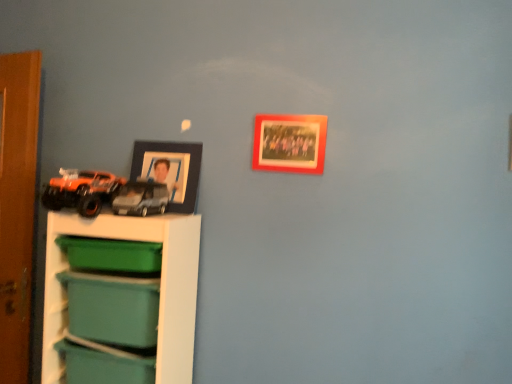
This screenshot has height=384, width=512. What do you see at coordinates (104, 363) in the screenshot?
I see `teal plastic storage box at lower left, which is counted as the third storage box, starting from the top` at bounding box center [104, 363].

How much space does green plastic storage box at lower left, the first storage box when ordered from top to bottom, occupy vertically?

green plastic storage box at lower left, the first storage box when ordered from top to bottom, is 11.07 centimeters in height.

Describe the element at coordinates (111, 254) in the screenshot. This screenshot has width=512, height=384. I see `green plastic storage box at lower left, the 3th storage box ordered from the bottom` at that location.

The image size is (512, 384). What do you see at coordinates (141, 199) in the screenshot?
I see `matte black car at left, arranged as the 1th toy when viewed from the right` at bounding box center [141, 199].

At what (x,y) coordinates should I click in order to perform the action: click on wooden photo frame at upper center, acting as the first picture frame starting from the right. Please return your answer as a coordinate pair (x, y). This screenshot has width=512, height=384. Looking at the image, I should click on (289, 143).

Does wooden photo frame at upper center, which is the 2th picture frame in left-to-right order, have a smaller size compared to green plastic storage box at lower left, the first storage box when ordered from top to bottom?

Yes, wooden photo frame at upper center, which is the 2th picture frame in left-to-right order, is smaller than green plastic storage box at lower left, the first storage box when ordered from top to bottom.

Is wooden photo frame at upper center, which is the 2th picture frame in left-to-right order, at the right side of green plastic storage box at lower left, the first storage box when ordered from top to bottom?

Indeed, wooden photo frame at upper center, which is the 2th picture frame in left-to-right order, is positioned on the right side of green plastic storage box at lower left, the first storage box when ordered from top to bottom.

Is wooden photo frame at upper center, acting as the first picture frame starting from the right, thinner than green plastic storage box at lower left, the first storage box when ordered from top to bottom?

Indeed, wooden photo frame at upper center, acting as the first picture frame starting from the right, has a lesser width compared to green plastic storage box at lower left, the first storage box when ordered from top to bottom.

From the image's perspective, would you say wooden photo frame at upper center, acting as the first picture frame starting from the right, is shown under green plastic storage box at lower left, the 3th storage box ordered from the bottom?

Actually, wooden photo frame at upper center, acting as the first picture frame starting from the right, appears above green plastic storage box at lower left, the 3th storage box ordered from the bottom, in the image.

Which of these two, matte green plastic storage box at lower left, the 2th storage box positioned from the top, or green plastic storage box at lower left, the 3th storage box ordered from the bottom, stands taller?

Standing taller between the two is matte green plastic storage box at lower left, the 2th storage box positioned from the top.

Is matte green plastic storage box at lower left, the 2th storage box when ordered from bottom to top, situated inside green plastic storage box at lower left, the 3th storage box ordered from the bottom, or outside?

matte green plastic storage box at lower left, the 2th storage box when ordered from bottom to top, is spatially situated outside green plastic storage box at lower left, the 3th storage box ordered from the bottom.

How much distance is there between matte green plastic storage box at lower left, the 2th storage box positioned from the top, and green plastic storage box at lower left, the 3th storage box ordered from the bottom?

matte green plastic storage box at lower left, the 2th storage box positioned from the top, is 4.68 inches from green plastic storage box at lower left, the 3th storage box ordered from the bottom.

Are matte green plastic storage box at lower left, the 2th storage box positioned from the top, and green plastic storage box at lower left, the first storage box when ordered from top to bottom, far apart?

No, matte green plastic storage box at lower left, the 2th storage box positioned from the top, is not far from green plastic storage box at lower left, the first storage box when ordered from top to bottom.

Is matte black car at left, which is the second toy in left-to-right order, positioned behind matte green plastic storage box at lower left, the 2th storage box when ordered from bottom to top?

Yes, matte black car at left, which is the second toy in left-to-right order, is further from the viewer.

Considering the points (121, 197) and (155, 316), which point is behind, point (121, 197) or point (155, 316)?

Point (121, 197)

Looking at this image, could you tell me if matte black car at left, arranged as the 1th toy when viewed from the right, is turned towards matte green plastic storage box at lower left, the 2th storage box positioned from the top?

No, matte black car at left, arranged as the 1th toy when viewed from the right, is not oriented towards matte green plastic storage box at lower left, the 2th storage box positioned from the top.

Which object is closer to the camera, green plastic storage box at lower left, the first storage box when ordered from top to bottom, or white plastic shelf at lower left?

white plastic shelf at lower left is closer to the camera.

From the image's perspective, is green plastic storage box at lower left, the first storage box when ordered from top to bottom, above white plastic shelf at lower left?

Yes, from the image's perspective, green plastic storage box at lower left, the first storage box when ordered from top to bottom, is over white plastic shelf at lower left.

From a real-world perspective, relative to white plastic shelf at lower left, is green plastic storage box at lower left, the 3th storage box ordered from the bottom, vertically above or below?

From a real-world perspective, green plastic storage box at lower left, the 3th storage box ordered from the bottom, is physically above white plastic shelf at lower left.

Is matte green plastic storage box at lower left, the 2th storage box when ordered from bottom to top, inside or outside of teal plastic storage box at lower left, which is counted as the third storage box, starting from the top?

matte green plastic storage box at lower left, the 2th storage box when ordered from bottom to top, exists outside the volume of teal plastic storage box at lower left, which is counted as the third storage box, starting from the top.

From the image's perspective, is matte green plastic storage box at lower left, the 2th storage box positioned from the top, above teal plastic storage box at lower left, the 1th storage box ordered from the bottom?

Yes, from the image's perspective, matte green plastic storage box at lower left, the 2th storage box positioned from the top, is over teal plastic storage box at lower left, the 1th storage box ordered from the bottom.

Is matte green plastic storage box at lower left, the 2th storage box positioned from the top, directly adjacent to teal plastic storage box at lower left, the 1th storage box ordered from the bottom?

matte green plastic storage box at lower left, the 2th storage box positioned from the top, and teal plastic storage box at lower left, the 1th storage box ordered from the bottom, are not in contact.

Is teal plastic storage box at lower left, which is counted as the third storage box, starting from the top, at the back of matte green plastic storage box at lower left, the 2th storage box when ordered from bottom to top?

That's not correct — matte green plastic storage box at lower left, the 2th storage box when ordered from bottom to top, is not looking away from teal plastic storage box at lower left, which is counted as the third storage box, starting from the top.

From a real-world perspective, does white plastic shelf at lower left stand above matte green plastic storage box at lower left, the 2th storage box when ordered from bottom to top?

Incorrect, from a real-world perspective, white plastic shelf at lower left is lower than matte green plastic storage box at lower left, the 2th storage box when ordered from bottom to top.

Is white plastic shelf at lower left aimed at matte green plastic storage box at lower left, the 2th storage box when ordered from bottom to top?

Yes, white plastic shelf at lower left is aimed at matte green plastic storage box at lower left, the 2th storage box when ordered from bottom to top.

In the image, is white plastic shelf at lower left on the left side or the right side of matte green plastic storage box at lower left, the 2th storage box positioned from the top?

white plastic shelf at lower left is to the left of matte green plastic storage box at lower left, the 2th storage box positioned from the top.

The width and height of the screenshot is (512, 384). I want to click on storage box that is the 1st object located behind the white plastic shelf at lower left, so click(112, 308).

Based on the photo, can you confirm if white plastic shelf at lower left is bigger than orange matte truck at left, which is counted as the first toy, starting from the left?

Correct, white plastic shelf at lower left is larger in size than orange matte truck at left, which is counted as the first toy, starting from the left.

You are a GUI agent. You are given a task and a screenshot of the screen. Output one action in this format:
    pyautogui.click(x=<x>, y=<y>)
    Task: Click on the shelf below the orange matte truck at left, arranged as the 2th toy when viewed from the right (from the image's perspective)
    This screenshot has height=384, width=512.
    Given the screenshot: What is the action you would take?
    pyautogui.click(x=160, y=284)

Can you tell me how much white plastic shelf at lower left and orange matte truck at left, arranged as the 2th toy when viewed from the right, differ in facing direction?

They differ by 2.94 degrees in their facing directions.

Does white plastic shelf at lower left have a lesser height compared to orange matte truck at left, which is counted as the first toy, starting from the left?

In fact, white plastic shelf at lower left may be taller than orange matte truck at left, which is counted as the first toy, starting from the left.

Identify the location of the 2nd picture frame above when counting from the green plastic storage box at lower left, the 3th storage box ordered from the bottom (from the image's perspective). Image resolution: width=512 pixels, height=384 pixels. (289, 143).

Starting from the matte green plastic storage box at lower left, the 2th storage box when ordered from bottom to top, which storage box is the 2nd one behind? Please provide its 2D coordinates.

[(111, 254)]

Considering their positions, is wooden photo frame at upper center, which is the 2th picture frame in left-to-right order, positioned further to matte black car at left, arranged as the 1th toy when viewed from the right, than orange matte truck at left, which is counted as the first toy, starting from the left?

Based on the image, wooden photo frame at upper center, which is the 2th picture frame in left-to-right order, appears to be further to matte black car at left, arranged as the 1th toy when viewed from the right.

Looking at the image, which one is located further to green plastic storage box at lower left, the 3th storage box ordered from the bottom, black matte picture frame at upper left, the 2th picture frame in the right-to-left sequence, or matte black car at left, arranged as the 1th toy when viewed from the right?

black matte picture frame at upper left, the 2th picture frame in the right-to-left sequence, is further to green plastic storage box at lower left, the 3th storage box ordered from the bottom.

Based on their spatial positions, is orange matte truck at left, arranged as the 2th toy when viewed from the right, or teal plastic storage box at lower left, the 1th storage box ordered from the bottom, closer to white plastic shelf at lower left?

teal plastic storage box at lower left, the 1th storage box ordered from the bottom.

Considering their positions, is wooden photo frame at upper center, acting as the first picture frame starting from the front, positioned further to matte black car at left, which is the second toy in left-to-right order, than matte green plastic storage box at lower left, the 2th storage box positioned from the top?

Based on the image, wooden photo frame at upper center, acting as the first picture frame starting from the front, appears to be further to matte black car at left, which is the second toy in left-to-right order.

When comparing their distances from black matte picture frame at upper left, arranged as the second picture frame when viewed from the front, does matte green plastic storage box at lower left, the 2th storage box when ordered from bottom to top, or white plastic shelf at lower left seem closer?

Among the two, white plastic shelf at lower left is located nearer to black matte picture frame at upper left, arranged as the second picture frame when viewed from the front.

Based on their spatial positions, is teal plastic storage box at lower left, the 1th storage box ordered from the bottom, or green plastic storage box at lower left, the first storage box when ordered from top to bottom, closer to white plastic shelf at lower left?

green plastic storage box at lower left, the first storage box when ordered from top to bottom.

Which object lies further to the anchor point matte green plastic storage box at lower left, the 2th storage box when ordered from bottom to top, wooden photo frame at upper center, which is the 2th picture frame in left-to-right order, or teal plastic storage box at lower left, which is counted as the third storage box, starting from the top?

Based on the image, wooden photo frame at upper center, which is the 2th picture frame in left-to-right order, appears to be further to matte green plastic storage box at lower left, the 2th storage box when ordered from bottom to top.

Estimate the real-world distances between objects in this image. Which object is closer to green plastic storage box at lower left, the first storage box when ordered from top to bottom, teal plastic storage box at lower left, the 1th storage box ordered from the bottom, or black matte picture frame at upper left, which is the 1th picture frame from back to front?

Among the two, teal plastic storage box at lower left, the 1th storage box ordered from the bottom, is located nearer to green plastic storage box at lower left, the first storage box when ordered from top to bottom.

I want to click on storage box between green plastic storage box at lower left, the 3th storage box ordered from the bottom, and teal plastic storage box at lower left, the 1th storage box ordered from the bottom, from top to bottom, so click(112, 308).

You are a GUI agent. You are given a task and a screenshot of the screen. Output one action in this format:
    pyautogui.click(x=<x>, y=<y>)
    Task: Click on the toy between green plastic storage box at lower left, the first storage box when ordered from top to bottom, and wooden photo frame at upper center, acting as the first picture frame starting from the right
    This screenshot has width=512, height=384.
    Given the screenshot: What is the action you would take?
    pyautogui.click(x=141, y=199)

At what (x,y) coordinates should I click in order to perform the action: click on storage box between matte black car at left, arranged as the 1th toy when viewed from the right, and matte green plastic storage box at lower left, the 2th storage box positioned from the top, vertically. Please return your answer as a coordinate pair (x, y). Looking at the image, I should click on (111, 254).

Find the location of `picture frame between wooden photo frame at upper center, the 2th picture frame from the back, and teal plastic storage box at lower left, the 1th storage box ordered from the bottom, vertically`. picture frame between wooden photo frame at upper center, the 2th picture frame from the back, and teal plastic storage box at lower left, the 1th storage box ordered from the bottom, vertically is located at coordinates (170, 170).